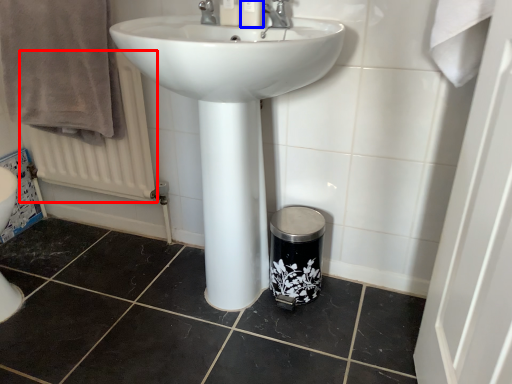
Question: Which of the following is the farthest to the observer, radiator (highlighted by a red box) or toiletry (highlighted by a blue box)?

Choices:
 (A) radiator
 (B) toiletry

Answer: (A)